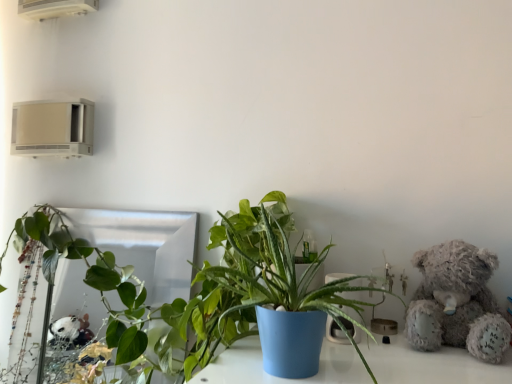
Question: Should I look upward or downward to see green leafy plant at center, which is counted as the first houseplant, starting from the right?

Choices:
 (A) down
 (B) up

Answer: (A)

Question: Considering the relative sizes of fluffy gray teddy bear at right and green leafy plant at center, which is counted as the first houseplant, starting from the right, in the image provided, is fluffy gray teddy bear at right taller than green leafy plant at center, which is counted as the first houseplant, starting from the right,?

Choices:
 (A) yes
 (B) no

Answer: (B)

Question: From the image's perspective, is fluffy gray teddy bear at right below green leafy plant at center, the 1th houseplant positioned from the front?

Choices:
 (A) no
 (B) yes

Answer: (B)

Question: Is fluffy gray teddy bear at right outside green leafy plant at center, acting as the 2th houseplant starting from the back?

Choices:
 (A) no
 (B) yes

Answer: (B)

Question: Is fluffy gray teddy bear at right shorter than green leafy plant at center, the 1th houseplant positioned from the front?

Choices:
 (A) no
 (B) yes

Answer: (B)

Question: Is fluffy gray teddy bear at right to the right of green leafy plant at center, placed as the second houseplant when sorted from left to right, from the viewer's perspective?

Choices:
 (A) no
 (B) yes

Answer: (B)

Question: From a real-world perspective, is fluffy gray teddy bear at right on top of green leafy plant at center, which is counted as the first houseplant, starting from the right?

Choices:
 (A) no
 (B) yes

Answer: (A)

Question: Can you confirm if green leafy plant at center, the 1th houseplant positioned from the front, is taller than white plastic air conditioner at upper left, which ranks as the 1th air conditioning in top-to-bottom order?

Choices:
 (A) yes
 (B) no

Answer: (A)

Question: From the image's perspective, is green leafy plant at center, acting as the 2th houseplant starting from the back, located beneath white plastic air conditioner at upper left, marked as the 2th air conditioning in a bottom-to-top arrangement?

Choices:
 (A) no
 (B) yes

Answer: (B)

Question: Is there a large distance between green leafy plant at center, placed as the second houseplant when sorted from left to right, and white plastic air conditioner at upper left, which ranks as the 1th air conditioning in top-to-bottom order?

Choices:
 (A) yes
 (B) no

Answer: (B)

Question: From the image's perspective, would you say green leafy plant at center, acting as the 2th houseplant starting from the back, is positioned over white plastic air conditioner at upper left, which ranks as the 1th air conditioning in top-to-bottom order?

Choices:
 (A) yes
 (B) no

Answer: (B)

Question: From a real-world perspective, does green leafy plant at center, acting as the 2th houseplant starting from the back, sit lower than white plastic air conditioner at upper left, marked as the 2th air conditioning in a bottom-to-top arrangement?

Choices:
 (A) no
 (B) yes

Answer: (B)

Question: Can you confirm if green leafy plant at center, the 1th houseplant positioned from the front, is bigger than white plastic air conditioner at upper left, marked as the 2th air conditioning in a bottom-to-top arrangement?

Choices:
 (A) yes
 (B) no

Answer: (A)

Question: Can you confirm if white plastic air conditioner at upper left, marked as the 2th air conditioning in a bottom-to-top arrangement, is smaller than fluffy gray teddy bear at right?

Choices:
 (A) no
 (B) yes

Answer: (B)